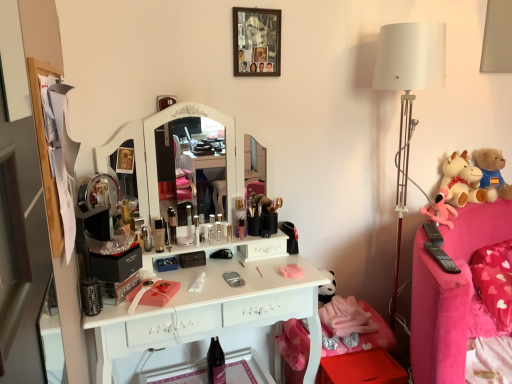
Question: Does pink fabric plush at right, marked as the 1th toy in a left-to-right arrangement, appear on the left side of pink fabric swivel chair at lower right?

Choices:
 (A) no
 (B) yes

Answer: (A)

Question: From a real-world perspective, does pink fabric plush at right, marked as the 1th toy in a left-to-right arrangement, stand above pink fabric swivel chair at lower right?

Choices:
 (A) yes
 (B) no

Answer: (A)

Question: Is pink fabric plush at right, marked as the 1th toy in a left-to-right arrangement, bigger than pink fabric swivel chair at lower right?

Choices:
 (A) no
 (B) yes

Answer: (A)

Question: Is pink fabric plush at right, marked as the 1th toy in a left-to-right arrangement, behind pink fabric swivel chair at lower right?

Choices:
 (A) yes
 (B) no

Answer: (A)

Question: Is pink fabric plush at right, the third toy in the right-to-left sequence, closer to camera compared to pink fabric swivel chair at lower right?

Choices:
 (A) yes
 (B) no

Answer: (B)

Question: Would you say white fabric lampshade at right is to the left or to the right of soft plush cow at right, acting as the 3th toy starting from the left, in the picture?

Choices:
 (A) right
 (B) left

Answer: (B)

Question: From the image's perspective, is white fabric lampshade at right located above or below soft plush cow at right, acting as the 3th toy starting from the left?

Choices:
 (A) below
 (B) above

Answer: (A)

Question: Considering the positions of white fabric lampshade at right and soft plush cow at right, acting as the 3th toy starting from the left, in the image, is white fabric lampshade at right bigger or smaller than soft plush cow at right, acting as the 3th toy starting from the left,?

Choices:
 (A) small
 (B) big

Answer: (B)

Question: Is white fabric lampshade at right inside or outside of soft plush cow at right, the first toy viewed from the right?

Choices:
 (A) inside
 (B) outside

Answer: (B)

Question: Is point (407, 72) positioned closer to the camera than point (217, 225)?

Choices:
 (A) farther
 (B) closer

Answer: (B)

Question: Considering the positions of white fabric lampshade at right and metallic silver toiletry at center, which is the fourth toiletry in left-to-right order, in the image, is white fabric lampshade at right taller or shorter than metallic silver toiletry at center, which is the fourth toiletry in left-to-right order,?

Choices:
 (A) tall
 (B) short

Answer: (A)

Question: In terms of size, does white fabric lampshade at right appear bigger or smaller than metallic silver toiletry at center, which is the fourth toiletry in left-to-right order?

Choices:
 (A) small
 (B) big

Answer: (B)

Question: Looking at their shapes, would you say white fabric lampshade at right is wider or thinner than metallic silver toiletry at center, which is the fourth toiletry in left-to-right order?

Choices:
 (A) thin
 (B) wide

Answer: (B)

Question: In terms of size, does white plush cow at right, which appears as the 2th toy when viewed from the left, appear bigger or smaller than pink fabric plush at right, marked as the 1th toy in a left-to-right arrangement?

Choices:
 (A) big
 (B) small

Answer: (A)

Question: From a real-world perspective, is white plush cow at right, the second toy viewed from the right, above or below pink fabric plush at right, marked as the 1th toy in a left-to-right arrangement?

Choices:
 (A) above
 (B) below

Answer: (A)